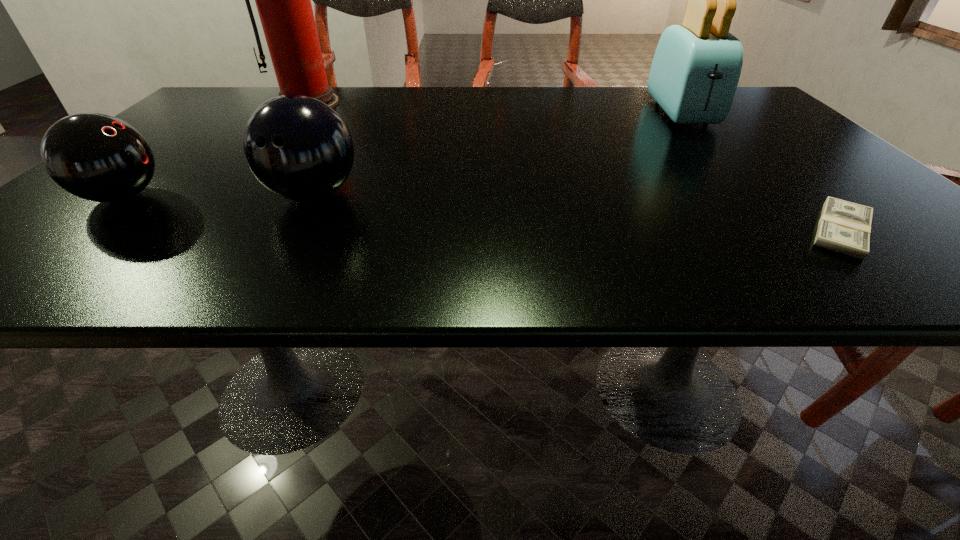
The height and width of the screenshot is (540, 960). In order to click on vacant region at the near edge of the desktop in this screenshot , I will do `click(142, 255)`.

Locate an element on the screen. This screenshot has height=540, width=960. free region at the left edge of the desktop is located at coordinates (161, 195).

At what (x,y) coordinates should I click in order to perform the action: click on free space at the right edge. Please return your answer as a coordinate pair (x, y). Looking at the image, I should click on (792, 145).

The image size is (960, 540). What are the coordinates of `free space between the right bowling ball and the second shortest object` in the screenshot? It's located at (218, 195).

This screenshot has height=540, width=960. I want to click on free space between the shortest object and the right bowling ball, so click(577, 212).

The height and width of the screenshot is (540, 960). What are the coordinates of `vacant space that is in between the fourth shortest object and the dollar` in the screenshot? It's located at (761, 171).

Locate an element on the screen. Image resolution: width=960 pixels, height=540 pixels. vacant area that lies between the leftmost object and the fire extinguisher is located at coordinates (216, 150).

The image size is (960, 540). Find the location of `empty location between the right bowling ball and the dollar`. empty location between the right bowling ball and the dollar is located at coordinates (577, 212).

The width and height of the screenshot is (960, 540). I want to click on empty location between the leftmost object and the shortest object, so click(x=483, y=213).

Find the location of `vacant point located between the dollar and the right bowling ball`. vacant point located between the dollar and the right bowling ball is located at coordinates (577, 212).